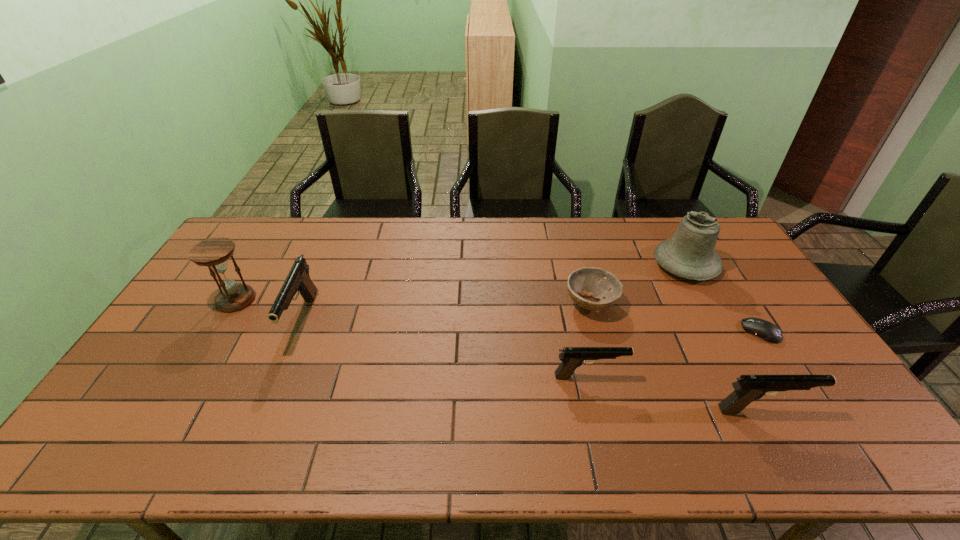
The image size is (960, 540). In order to click on object that stands as the second closest to the computer equipment in this screenshot , I will do `click(748, 388)`.

Identify which object is the sixth closest to the bell. Please provide its 2D coordinates. Your answer should be formatted as a tuple, i.e. [(x, y)], where the tuple contains the x and y coordinates of a point satisfying the conditions above.

[(214, 253)]

Select which pistol appears as the second closest to the nearest object. Please provide its 2D coordinates. Your answer should be formatted as a tuple, i.e. [(x, y)], where the tuple contains the x and y coordinates of a point satisfying the conditions above.

[(298, 281)]

This screenshot has height=540, width=960. Find the location of `pistol that is the second closest one to the shortest object`. pistol that is the second closest one to the shortest object is located at coordinates (572, 357).

Where is `vacant space that satisfies the following two spatial constraints: 1. on the front side of the shortest object; 2. at the muzzle of the fifth tallest object`? The image size is (960, 540). vacant space that satisfies the following two spatial constraints: 1. on the front side of the shortest object; 2. at the muzzle of the fifth tallest object is located at coordinates (789, 376).

Find the location of a particular element. The image size is (960, 540). free spot that satisfies the following two spatial constraints: 1. on the front side of the bell; 2. on the right side of the shortest object is located at coordinates (722, 332).

Identify the location of free region that satisfies the following two spatial constraints: 1. on the front side of the leftmost object; 2. on the right side of the shortest object. (217, 332).

In order to click on vacant region that satisfies the following two spatial constraints: 1. at the muzzle of the shortest object; 2. on the right side of the farthest pistol in this screenshot , I will do `click(298, 332)`.